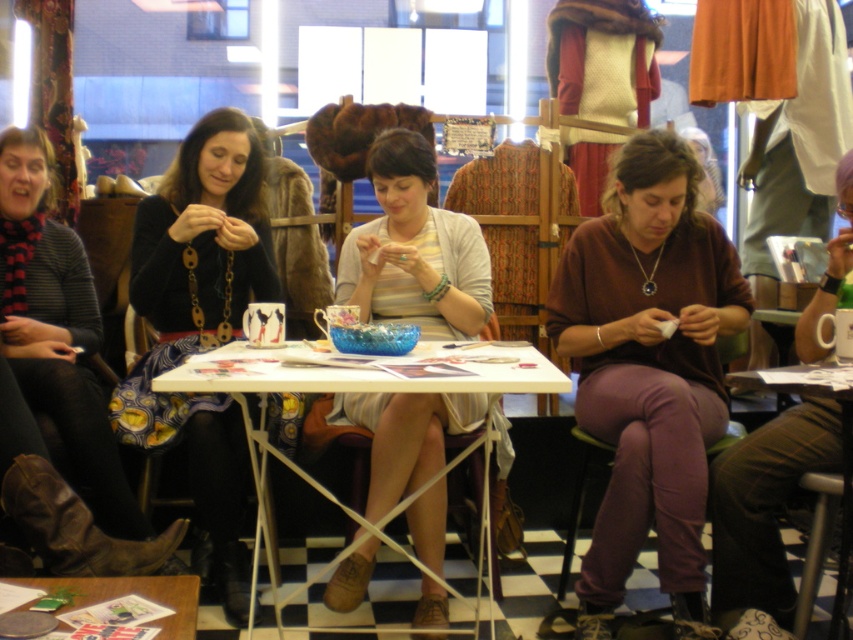
Question: Which of these objects is positioned closest to the brown matte sweater at center?

Choices:
 (A) white plastic table at center
 (B) matte black sweater at center
 (C) wooden table at lower right

Answer: (C)

Question: Among these points, which one is nearest to the camera?

Choices:
 (A) (74, 262)
 (B) (616, 531)
 (C) (154, 419)

Answer: (B)

Question: Does matte black sweater at center lie in front of wooden table at lower right?

Choices:
 (A) yes
 (B) no

Answer: (B)

Question: Considering the relative positions of brown matte sweater at center and striped cotton shirt at center in the image provided, where is brown matte sweater at center located with respect to striped cotton shirt at center?

Choices:
 (A) below
 (B) above

Answer: (A)

Question: Which point is farther from the camera taking this photo?

Choices:
 (A) (415, 186)
 (B) (733, 378)

Answer: (A)

Question: Can you confirm if matte black sweater at center is wider than wooden table at lower left?

Choices:
 (A) no
 (B) yes

Answer: (B)